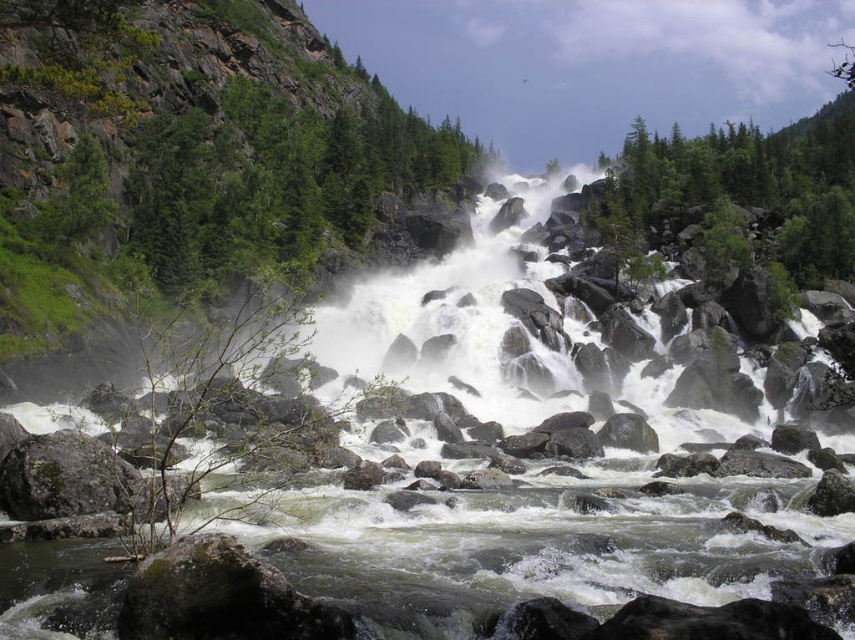
You are a hiker standing at the edge of the river and want to reach the green leafy tree at left. Given that your average walking speed is 1.5 meters per second, how long would it take you to walk directly to the tree?

The distance between you and the green leafy tree at left is 41.79 meters. At a walking speed of 1.5 meters per second, it would take approximately 27.86 seconds to reach the tree.

From the picture: You are standing at the point labeled as point (193, 145) in the scene. Looking around, you see a steep rocky cliff face covered with sparse vegetation on the left and a dense forest of coniferous trees on the right. Which direction should you move to reach the nearest green leafy tree?

The point (193, 145) is on the green leafy tree at left, so you are already on the nearest green leafy tree. There is no need to move.

You are a hiker trying to cross the river. You notice two trees on the bank. The green leafy tree at left and the green leafy tree at upper right. Which tree is taller and could provide a better vantage point for assessing the river current?

The green leafy tree at upper right is taller than the green leafy tree at left, so it would provide a better vantage point for assessing the river current.